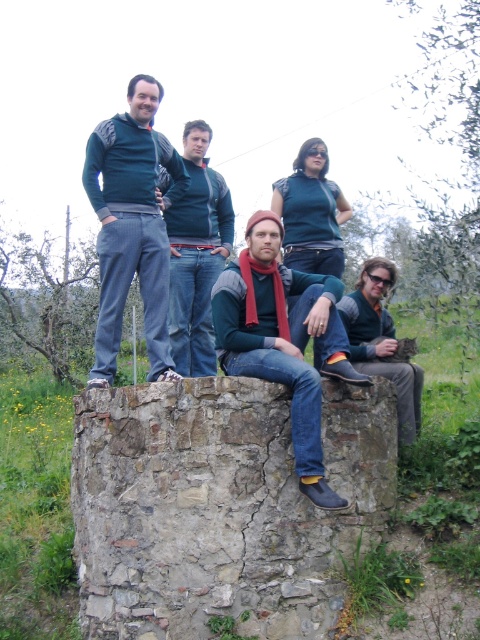
Describe the element at coordinates (220, 506) in the screenshot. I see `rusty concrete wall at center` at that location.

Can you confirm if rusty concrete wall at center is bigger than matte green sweater at upper left?

No.

Describe the element at coordinates (220, 506) in the screenshot. The height and width of the screenshot is (640, 480). I see `rusty concrete wall at center` at that location.

Locate an element on the screen. The height and width of the screenshot is (640, 480). rusty concrete wall at center is located at coordinates (220, 506).

How far apart are knit wool scarf at center and gray wool sweater at center?

knit wool scarf at center and gray wool sweater at center are 1.13 meters apart.

Is point (334, 349) positioned after point (367, 284)?

No, it is not.

Locate an element on the screen. knit wool scarf at center is located at coordinates (284, 339).

Locate an element on the screen. This screenshot has width=480, height=640. knit wool scarf at center is located at coordinates point(284,339).

Which is below, rusty concrete wall at center or knit wool scarf at center?

rusty concrete wall at center is lower down.

Locate an element on the screen. rusty concrete wall at center is located at coordinates (220, 506).

What do you see at coordinates (220, 506) in the screenshot?
I see `rusty concrete wall at center` at bounding box center [220, 506].

Identify the location of rusty concrete wall at center. (220, 506).